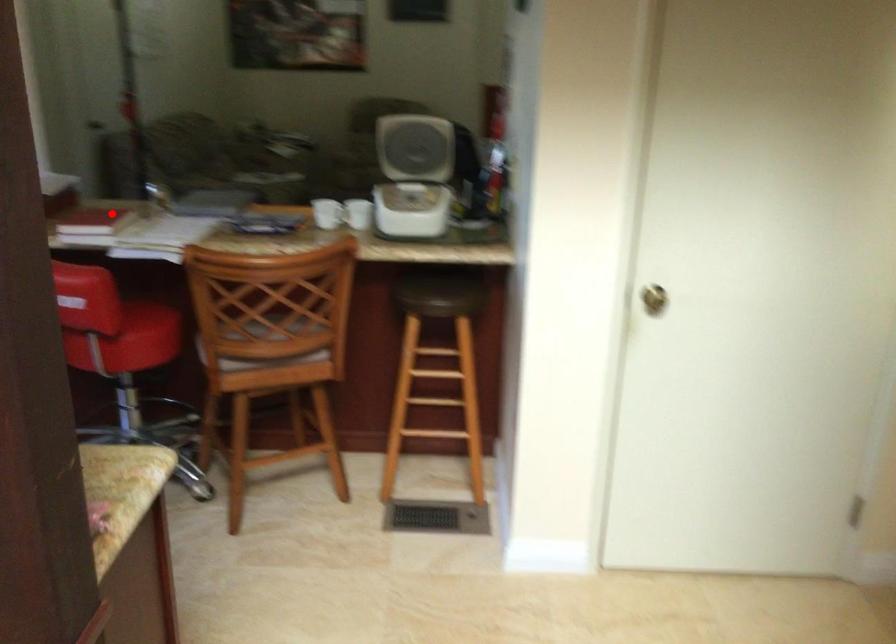
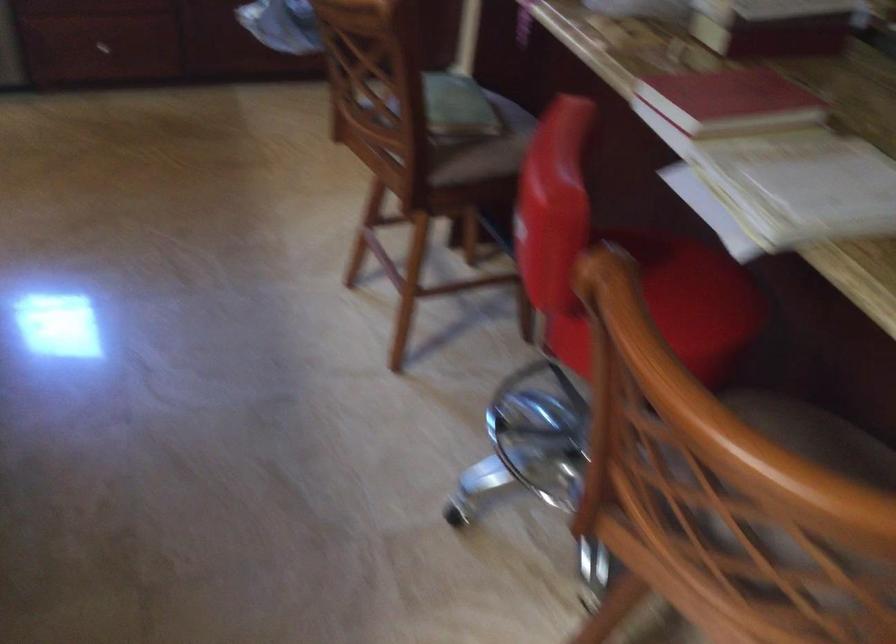
Question: I am providing you with two images of the same scene from different viewpoints. Image1 has a red point marked. In image2, the corresponding 3D location appears at what relative position? Reply with the corresponding letter.

Choices:
 (A) Closer
 (B) Farther

Answer: (A)